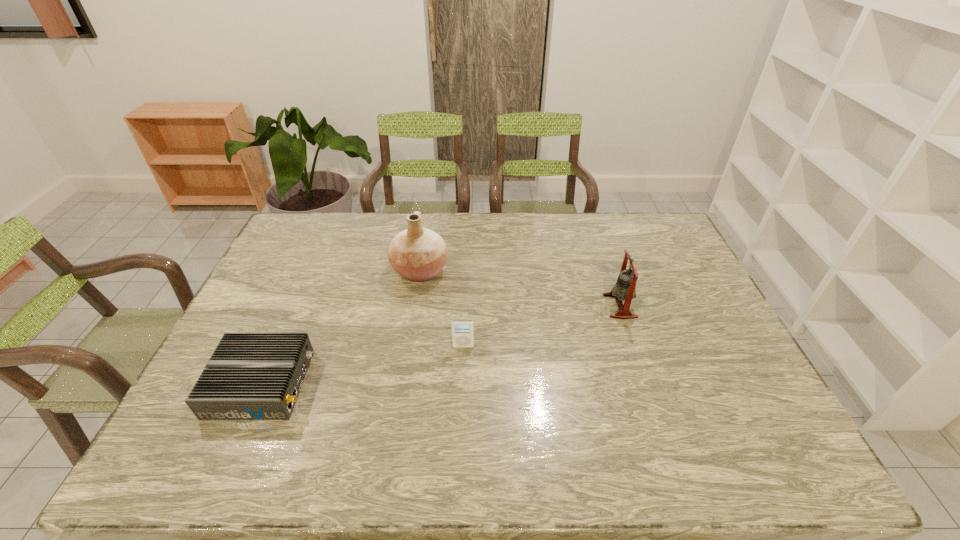
Locate an element on the screen. This screenshot has height=540, width=960. the third object from right to left is located at coordinates (418, 254).

This screenshot has width=960, height=540. In order to click on pottery in this screenshot , I will do `click(418, 254)`.

Identify the location of the third nearest object. (625, 288).

In order to click on bell in this screenshot , I will do `click(625, 288)`.

Identify the location of the third tallest object. (462, 330).

Find the location of a particular element. The height and width of the screenshot is (540, 960). the third object from left to right is located at coordinates (462, 330).

This screenshot has height=540, width=960. I want to click on the shortest object, so click(250, 376).

Identify the location of router. The image size is (960, 540). (250, 376).

What are the coordinates of `vacant point located 0.110m to pour from the handle of the pottery` in the screenshot? It's located at (482, 271).

The image size is (960, 540). I want to click on free space located on the left of the rightmost object, so pyautogui.click(x=589, y=306).